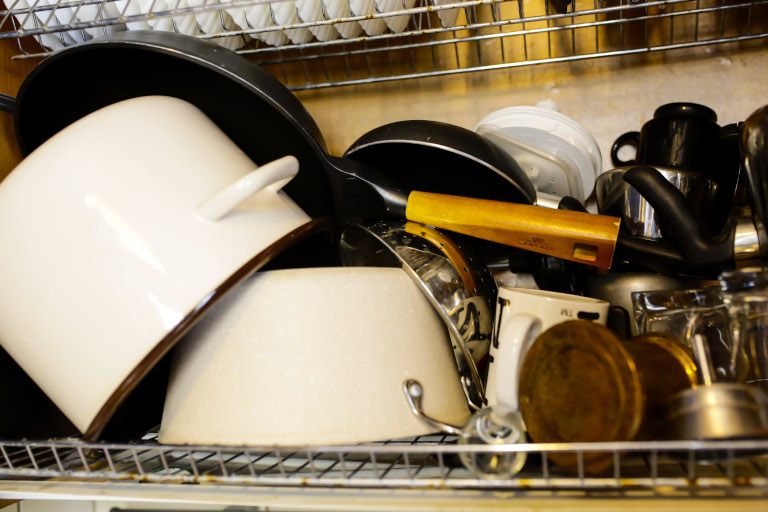
Where is `cup`? This screenshot has width=768, height=512. cup is located at coordinates (664, 136).